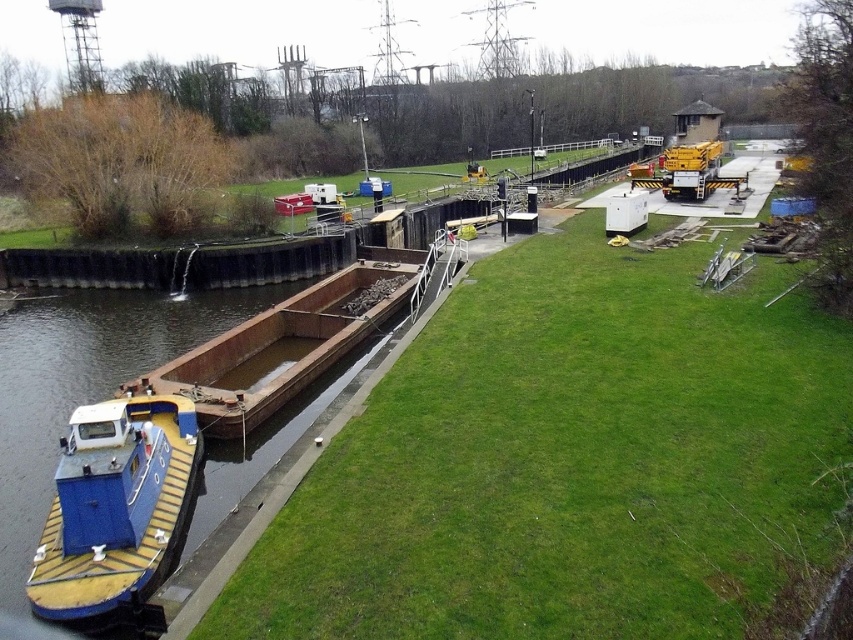
Question: Observing the image, what is the correct spatial positioning of green grass at center in reference to blue painted wood boat at lower left?

Choices:
 (A) left
 (B) right

Answer: (B)

Question: Among these objects, which one is nearest to the camera?

Choices:
 (A) blue painted wood boat at lower left
 (B) green grass at center

Answer: (B)

Question: Does green grass at center appear over blue painted wood boat at lower left?

Choices:
 (A) no
 (B) yes

Answer: (B)

Question: Is green grass at center further to camera compared to blue painted wood boat at lower left?

Choices:
 (A) no
 (B) yes

Answer: (A)